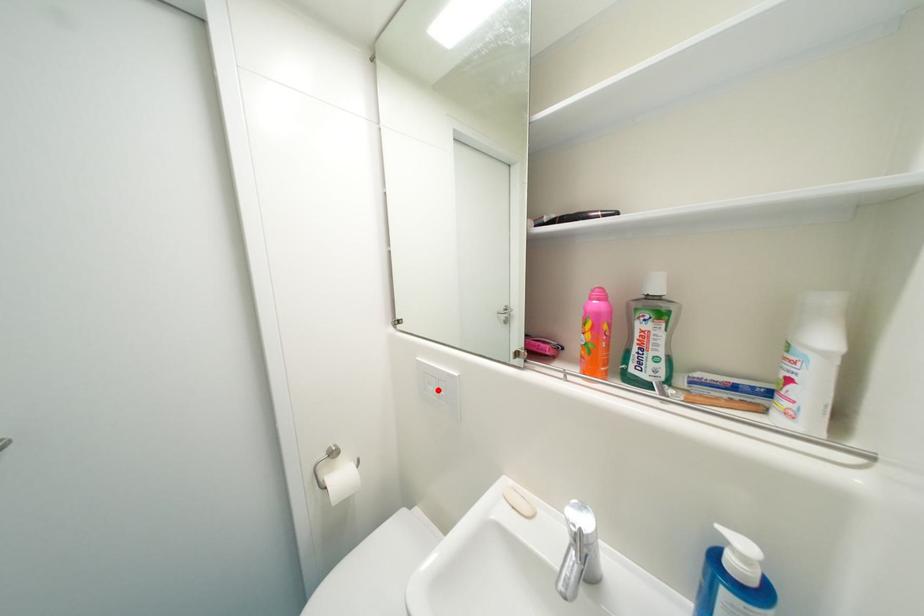
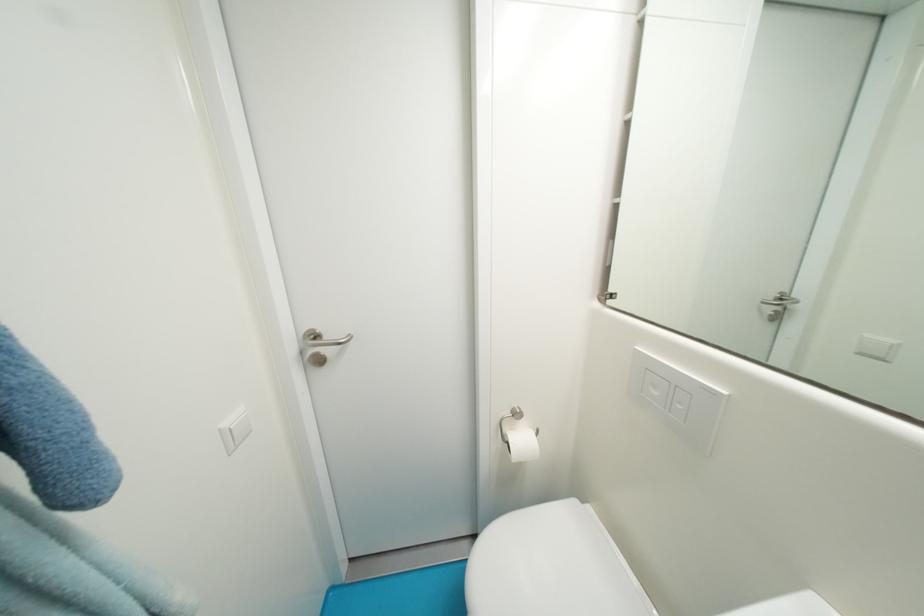
In the second image, find the point that corresponds to the highlighted location in the first image.

(662, 395)